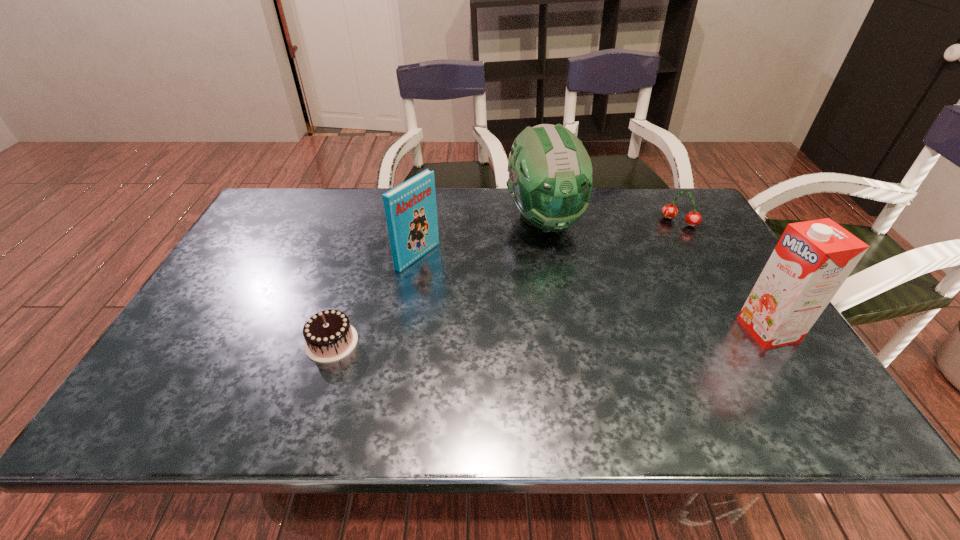
At what (x,y) coordinates should I click in order to perform the action: click on free space at the near right corner. Please return your answer as a coordinate pair (x, y). This screenshot has height=540, width=960. Looking at the image, I should click on (752, 380).

Where is `empty location between the cherry and the book`? empty location between the cherry and the book is located at coordinates (548, 239).

The height and width of the screenshot is (540, 960). What are the coordinates of `unoccupied area between the third object from left to right and the book` in the screenshot? It's located at (480, 238).

At what (x,y) coordinates should I click in order to perform the action: click on free spot between the third shortest object and the carton. Please return your answer as a coordinate pair (x, y). Looking at the image, I should click on coord(592,293).

Image resolution: width=960 pixels, height=540 pixels. Find the location of `free space between the carton and the football helmet`. free space between the carton and the football helmet is located at coordinates (656, 275).

This screenshot has width=960, height=540. In order to click on vacant point located between the carton and the cherry in this screenshot , I will do `click(724, 276)`.

Where is `free spot between the third object from right to left and the third shortest object`? Image resolution: width=960 pixels, height=540 pixels. free spot between the third object from right to left and the third shortest object is located at coordinates (480, 238).

In order to click on empty space between the leftmost object and the second shortest object in this screenshot , I will do `click(505, 282)`.

Image resolution: width=960 pixels, height=540 pixels. Identify the location of unoccupied area between the third object from left to right and the chocolate cake. (438, 281).

Locate an element on the screen. free space that is in between the leftmost object and the second shortest object is located at coordinates (505, 282).